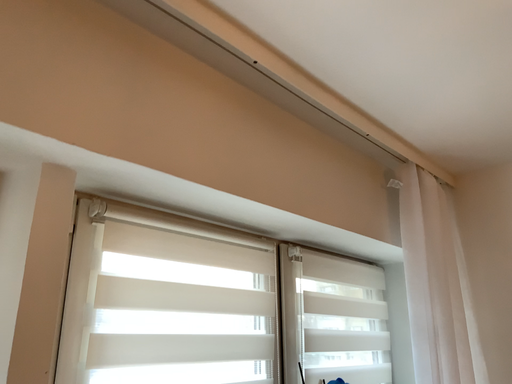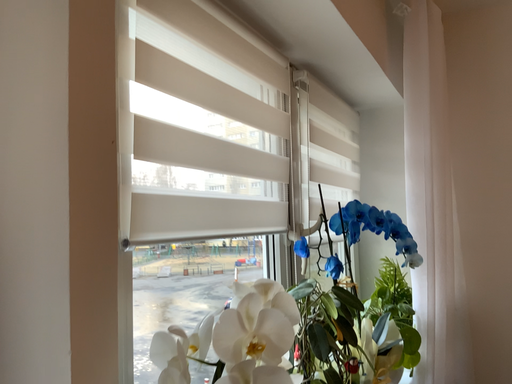
Question: Which way did the camera rotate in the video?

Choices:
 (A) rotated downward
 (B) rotated upward

Answer: (A)